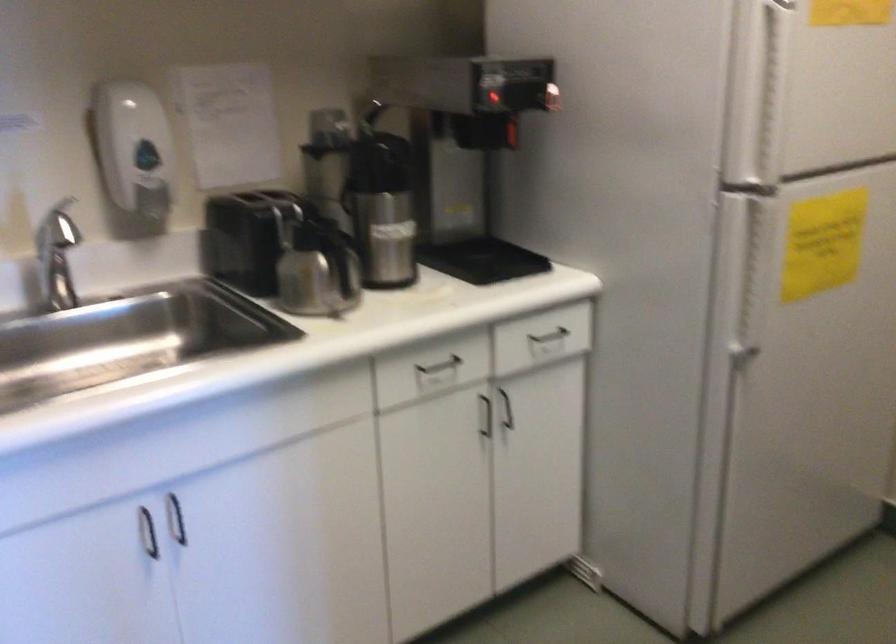
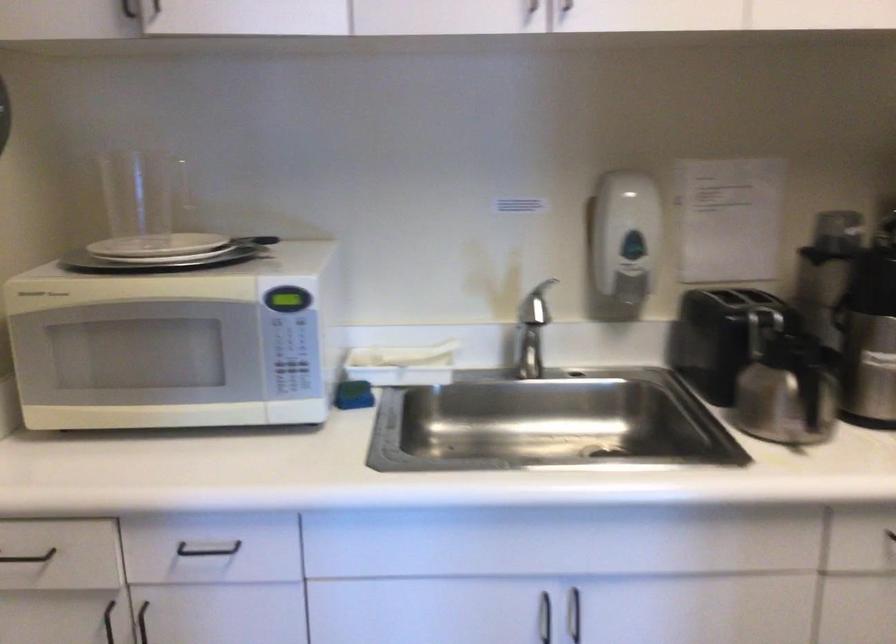
Where in the second image is the point corresponding to (340,268) from the first image?

(810, 395)